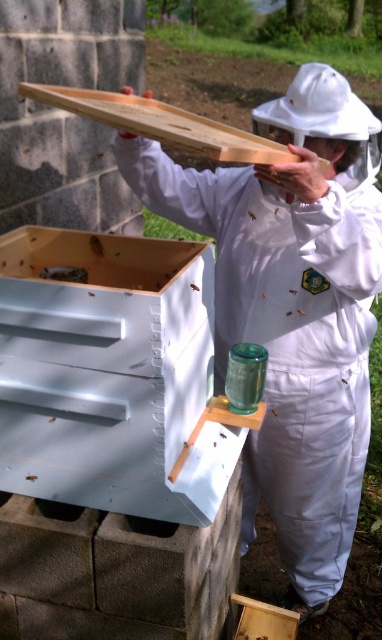
Is white painted wood beehive at lower left above translucent yellowish honeycomb at upper center?

No, white painted wood beehive at lower left is not above translucent yellowish honeycomb at upper center.

Which is in front, point (37, 252) or point (247, 211)?

Point (37, 252)

Where is `white painted wood beehive at lower left`? white painted wood beehive at lower left is located at coordinates (113, 376).

Between translucent yellowish honeycomb at upper center and translucent plastic bee at upper center, which one has more height?

translucent yellowish honeycomb at upper center

Locate an element on the screen. The image size is (382, 640). translucent yellowish honeycomb at upper center is located at coordinates (252, 214).

Find the location of a particular element. translucent yellowish honeycomb at upper center is located at coordinates (252, 214).

Between white matte beekeeper suit at center and translucent plastic bee at upper center, which one appears on the right side from the viewer's perspective?

From the viewer's perspective, white matte beekeeper suit at center appears more on the right side.

How far apart are white matte beekeeper suit at center and translucent plastic bee at upper center?

A distance of 20.16 inches exists between white matte beekeeper suit at center and translucent plastic bee at upper center.

The height and width of the screenshot is (640, 382). In order to click on white matte beekeeper suit at center in this screenshot , I will do `click(292, 308)`.